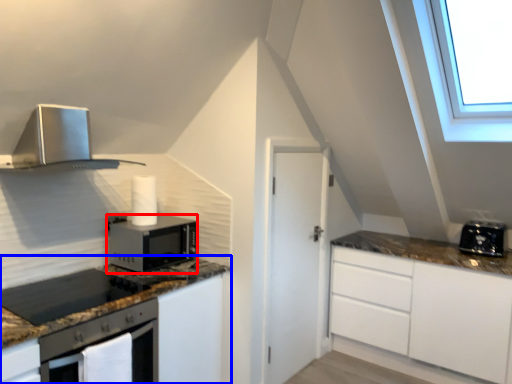
Question: Which point is further to the camera, microwave oven (highlighted by a red box) or cabinetry (highlighted by a blue box)?

Choices:
 (A) microwave oven
 (B) cabinetry

Answer: (A)